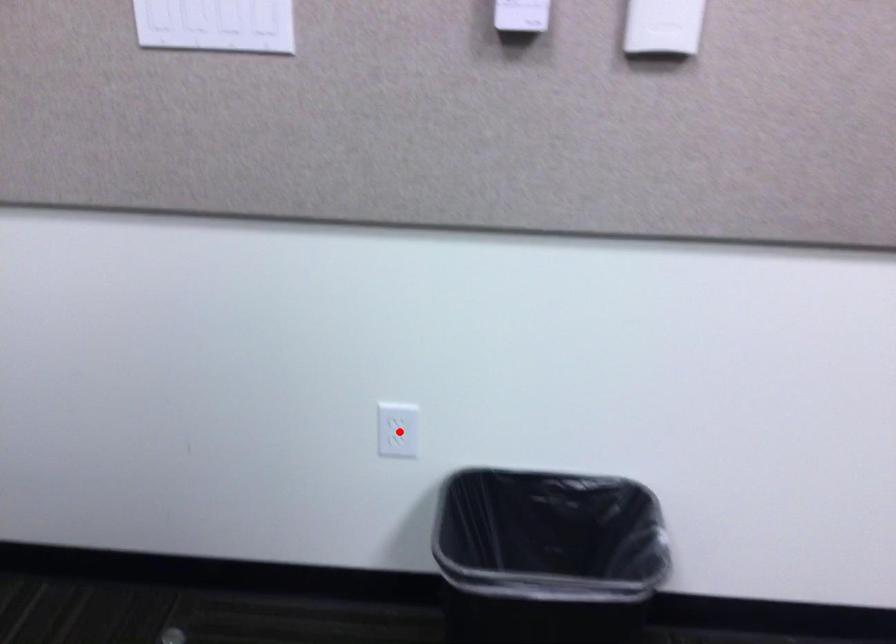
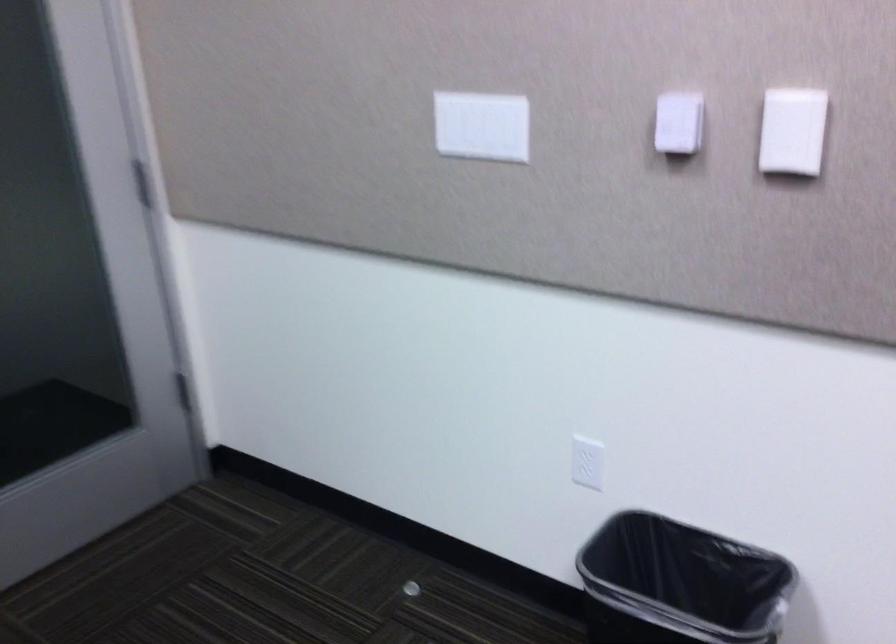
Locate, in the second image, the point that corresponds to the highlighted location in the first image.

(587, 462)